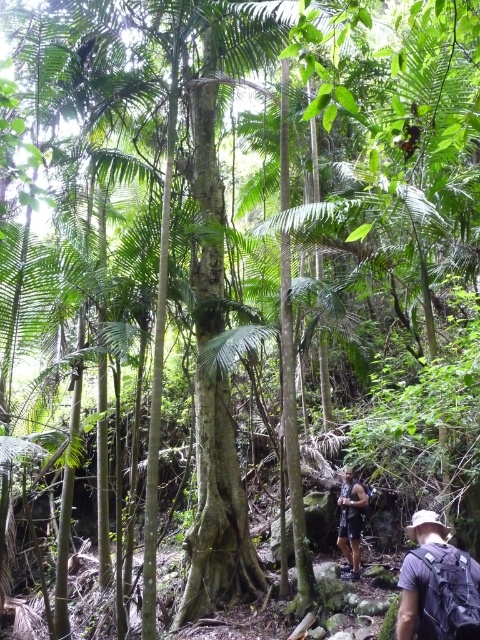
You are a hiker preparing to pack your gear. You have two backpacks available in the scene. Which backpack, the gray fabric backpack at lower right or the dark brown leather backpack at lower right, has a larger capacity based on their widths?

The gray fabric backpack at lower right might be wider than dark brown leather backpack at lower right, so it likely has a larger capacity.

You are a hiker who just arrived at the forest and see the gray fabric backpack at lower right and the dark brown leather backpack at lower right. Which backpack can you carry more items in?

The dark brown leather backpack at lower right is larger than the gray fabric backpack at lower right, so it can carry more items.